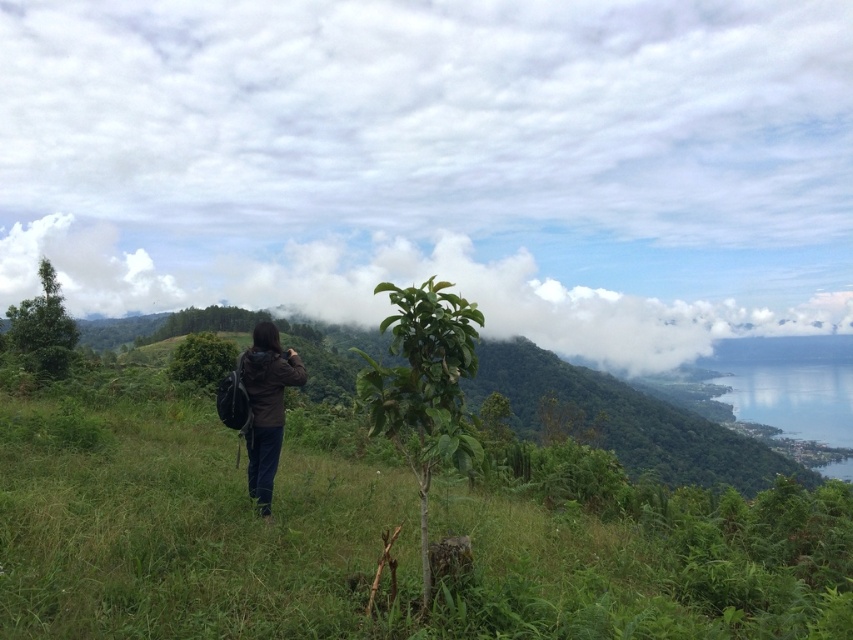
Who is more distant from viewer, (469, 371) or (248, 456)?

Positioned behind is point (248, 456).

Find the location of a particular element. green leafy tree at center is located at coordinates (424, 387).

Find the location of a particular element. The height and width of the screenshot is (640, 853). green leafy tree at center is located at coordinates (424, 387).

Is green leafy tree at center in front of green leafy tree at left?

That is True.

Between green leafy tree at center and green leafy tree at left, which one has less height?

green leafy tree at left is shorter.

This screenshot has width=853, height=640. What do you see at coordinates (424, 387) in the screenshot?
I see `green leafy tree at center` at bounding box center [424, 387].

Identify the location of green leafy tree at center. The height and width of the screenshot is (640, 853). (424, 387).

Does white fluffy cloud at upper center have a greater width compared to green leafy bush at center?

Yes.

I want to click on white fluffy cloud at upper center, so click(404, 284).

At what (x,y) coordinates should I click in order to perform the action: click on white fluffy cloud at upper center. Please return your answer as a coordinate pair (x, y). The height and width of the screenshot is (640, 853). Looking at the image, I should click on (404, 284).